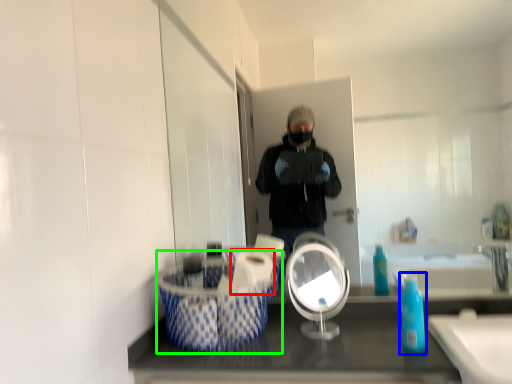
Question: Which object is the closest to the toilet paper (highlighted by a red box)? Choose among these: soap dispenser (highlighted by a blue box) or laundry basket (highlighted by a green box).

Choices:
 (A) soap dispenser
 (B) laundry basket

Answer: (B)